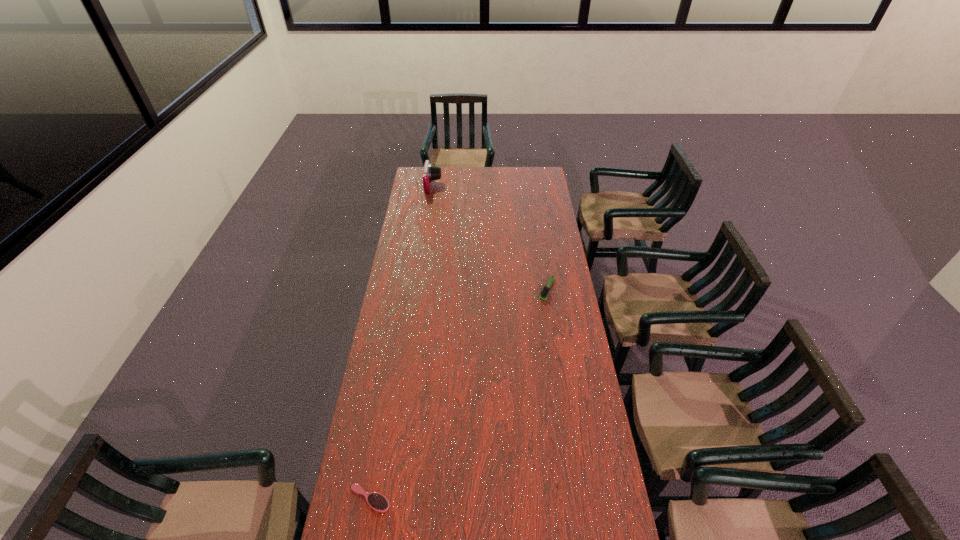
The height and width of the screenshot is (540, 960). Identify the location of the tallest object. (431, 172).

Identify the location of the farthest object. coord(431,172).

At what (x,y) coordinates should I click in order to perform the action: click on the second farthest object. Please return your answer as a coordinate pair (x, y). Looking at the image, I should click on (545, 291).

At what (x,y) coordinates should I click in order to perform the action: click on the farther hairbrush. Please return your answer as a coordinate pair (x, y). This screenshot has height=540, width=960. Looking at the image, I should click on (545, 291).

Identify the location of the nearest object. The width and height of the screenshot is (960, 540). (378, 502).

This screenshot has height=540, width=960. Identify the location of the shorter hairbrush. (378, 502).

Find the location of a particular element. The width and height of the screenshot is (960, 540). free space located on the front-facing side of the farthest object is located at coordinates (495, 186).

Identify the location of vacant space situated on the front of the second farthest object. click(554, 335).

Image resolution: width=960 pixels, height=540 pixels. I want to click on vacant point located on the right of the shorter hairbrush, so click(x=501, y=498).

Where is `object that is at the far edge`? The width and height of the screenshot is (960, 540). object that is at the far edge is located at coordinates (431, 172).